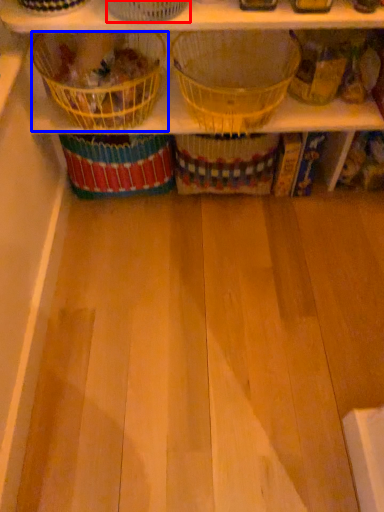
Question: Which of the following is the closest to the observer, basket (highlighted by a red box) or basket (highlighted by a blue box)?

Choices:
 (A) basket
 (B) basket

Answer: (A)